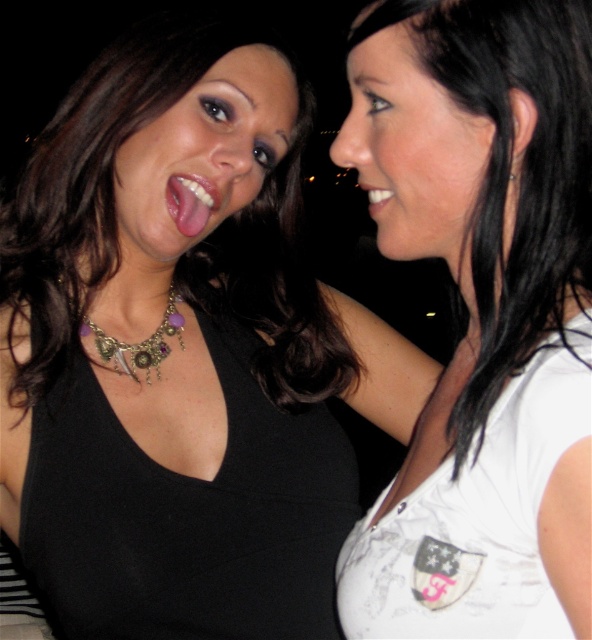
Does point (89, 284) lie behind point (513, 179)?

Yes, it is.

Who is shorter, black fabric top at center or silver metallic earring at upper right?

silver metallic earring at upper right is shorter.

Who is more distant from viewer, [278,419] or [509,170]?

Point [278,419]

Find the location of a particular element. Image resolution: width=592 pixels, height=640 pixels. black fabric top at center is located at coordinates (182, 353).

Can you confirm if white matte shirt at right is bigger than matte black face at center?

Correct, white matte shirt at right is larger in size than matte black face at center.

Locate an element on the screen. The width and height of the screenshot is (592, 640). white matte shirt at right is located at coordinates coord(482,316).

Is point (498, 61) positioned in front of point (249, 176)?

Yes, point (498, 61) is in front of point (249, 176).

Where is `white matte shirt at right`? white matte shirt at right is located at coordinates (482, 316).

Is point (408, 180) more distant than point (509, 176)?

That is True.

The height and width of the screenshot is (640, 592). What do you see at coordinates (413, 148) in the screenshot?
I see `matte white face at upper right` at bounding box center [413, 148].

Locate an element on the screen. The image size is (592, 640). matte white face at upper right is located at coordinates (413, 148).

This screenshot has width=592, height=640. Find the location of `matte white face at upper right`. matte white face at upper right is located at coordinates (413, 148).